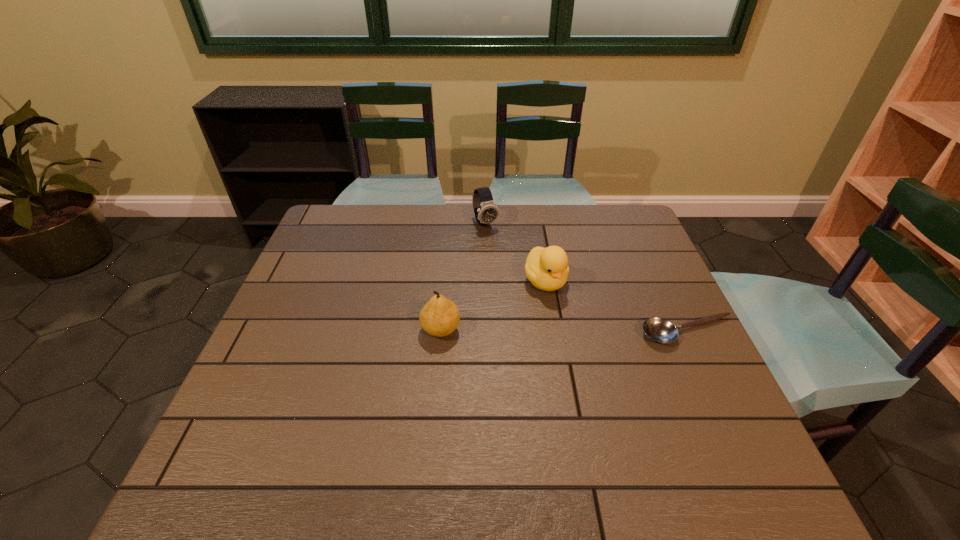
Locate an element on the screen. The width and height of the screenshot is (960, 540). free spot located 0.110m on the face of the farthest object is located at coordinates (502, 253).

In order to click on vacant space located on the face of the farthest object in this screenshot , I will do coord(528,295).

Find the location of a particular element. The height and width of the screenshot is (540, 960). vacant position located 0.350m on the front-facing side of the second farthest object is located at coordinates (636, 403).

The height and width of the screenshot is (540, 960). What are the coordinates of `free space located 0.330m on the front-facing side of the second farthest object` in the screenshot? It's located at (631, 396).

Find the location of a particular element. Image resolution: width=960 pixels, height=540 pixels. blank space located 0.070m on the front-facing side of the second farthest object is located at coordinates (569, 316).

Where is `object that is at the far edge`? The height and width of the screenshot is (540, 960). object that is at the far edge is located at coordinates point(485,209).

You are a GUI agent. You are given a task and a screenshot of the screen. Output one action in this format:
    pyautogui.click(x=<x>, y=<y>)
    Task: Click on the object at the right edge
    Image resolution: width=960 pixels, height=540 pixels.
    Given the screenshot: What is the action you would take?
    pyautogui.click(x=660, y=330)

I want to click on blank space at the far edge, so click(x=408, y=219).

The image size is (960, 540). Find the location of `blank space at the near edge`. blank space at the near edge is located at coordinates (647, 421).

Find the location of `free location at the left edge of the desktop`. free location at the left edge of the desktop is located at coordinates (275, 377).